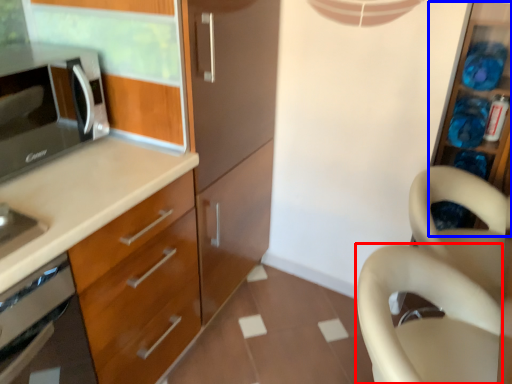
Question: Which of the following is the closest to the observer, swivel chair (highlighted by a red box) or cabinet (highlighted by a blue box)?

Choices:
 (A) swivel chair
 (B) cabinet

Answer: (A)